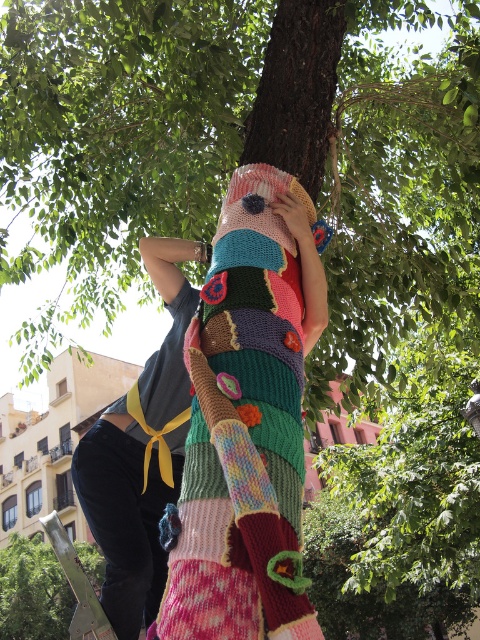
Can you confirm if knitted multicolored blanket at center is shorter than wooden post at lower left?

Correct, knitted multicolored blanket at center is not as tall as wooden post at lower left.

Is knitted multicolored blanket at center wider than wooden post at lower left?

No.

Is point (188, 580) positioned in front of point (21, 634)?

Yes, point (188, 580) is closer to viewer.

The width and height of the screenshot is (480, 640). Identify the location of knitted multicolored blanket at center. coord(247,422).